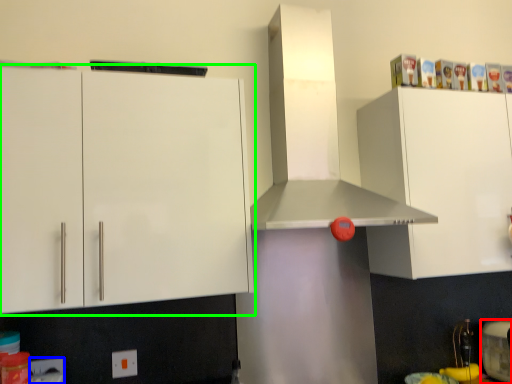
Question: Estimate the real-world distances between objects in this image. Which object is farther from appliance (highlighted by a red box), electric outlet (highlighted by a blue box) or cabinetry (highlighted by a green box)?

Choices:
 (A) electric outlet
 (B) cabinetry

Answer: (A)